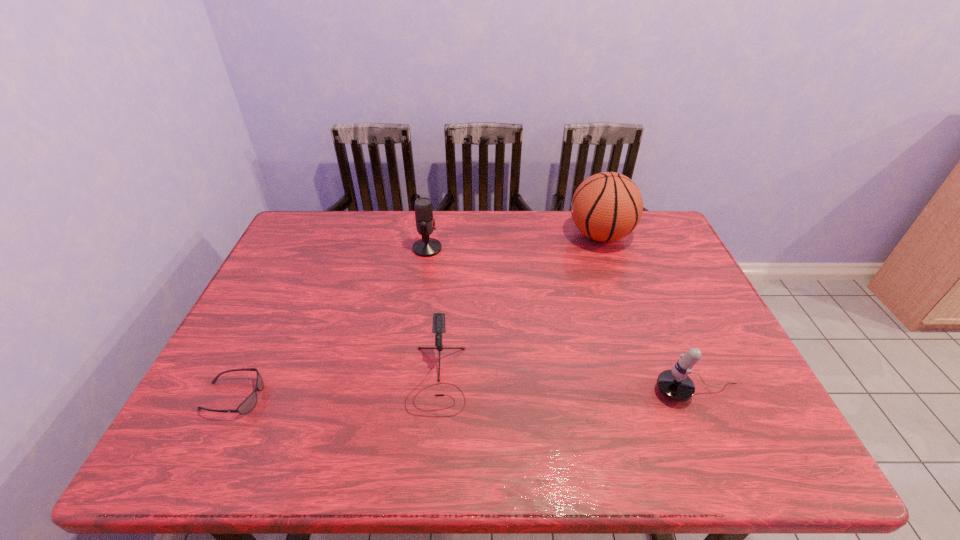
The width and height of the screenshot is (960, 540). I want to click on object present at the far right corner, so click(607, 206).

Identify the location of free spot at the far edge of the desktop. (468, 235).

I want to click on free spot at the near edge of the desktop, so click(x=680, y=459).

Find the location of a particular element. This screenshot has width=960, height=540. free space at the left edge is located at coordinates (314, 286).

You are a GUI agent. You are given a task and a screenshot of the screen. Output one action in this format:
    pyautogui.click(x=<x>, y=<y>)
    Task: Click on the vacant space at the right edge
    
    Given the screenshot: What is the action you would take?
    pyautogui.click(x=654, y=290)

In order to click on free region at the far left corner of the desktop in this screenshot , I will do `click(293, 233)`.

Where is `free region at the far right corner`? free region at the far right corner is located at coordinates (636, 247).

You are a GUI agent. You are given a task and a screenshot of the screen. Output one action in this format:
    pyautogui.click(x=<x>, y=<y>)
    Task: Click on the vacant space that is in between the shortest microphone and the leftmost object
    This screenshot has height=540, width=960.
    Given the screenshot: What is the action you would take?
    pyautogui.click(x=335, y=388)

At what (x,y) coordinates should I click in order to perform the action: click on free area in between the basketball and the second shortest object. Please return your answer as a coordinate pair (x, y). This screenshot has height=540, width=960. Looking at the image, I should click on (518, 307).

Locate an element on the screen. The width and height of the screenshot is (960, 540). empty space between the second shortest microphone and the farthest microphone is located at coordinates (563, 320).